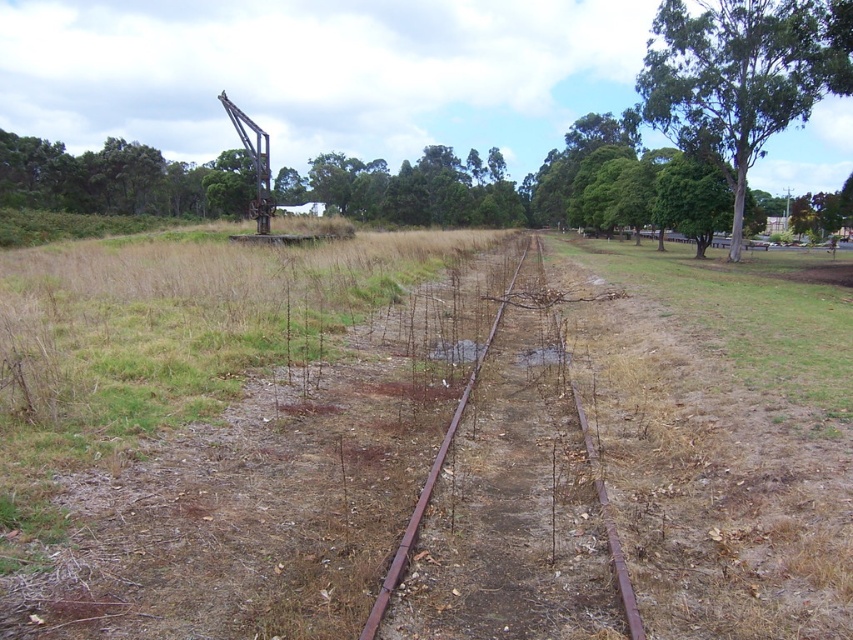
Between point (515, 592) and point (751, 13), which one is positioned behind?

The point (751, 13) is more distant.

In the scene shown: Does rusty metal train track at center have a greater height compared to green leafy tree at upper right?

No, rusty metal train track at center is not taller than green leafy tree at upper right.

Who is more forward, (503, 417) or (769, 19)?

Point (503, 417) is in front.

Where is `rusty metal train track at center`? rusty metal train track at center is located at coordinates (512, 499).